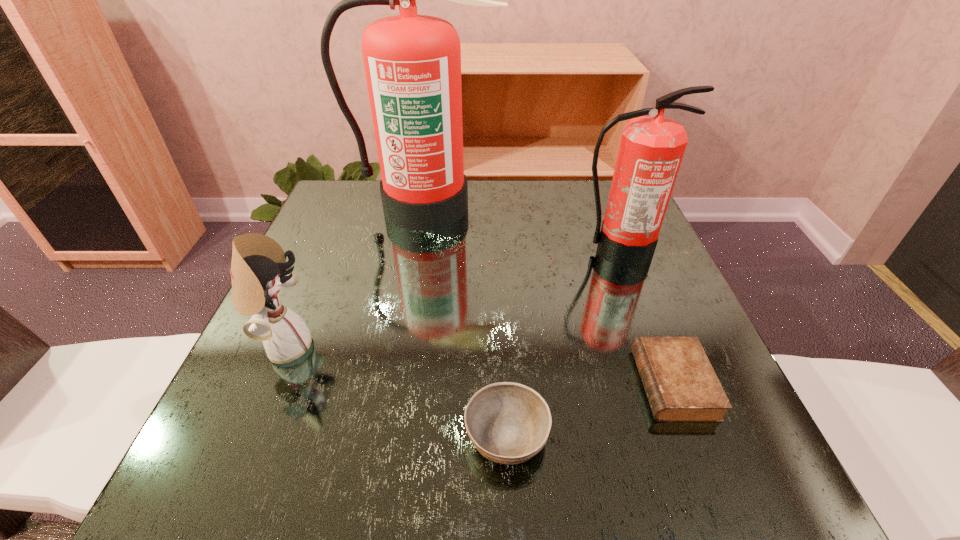
Where is `free space located on the back of the bowl`? Image resolution: width=960 pixels, height=540 pixels. free space located on the back of the bowl is located at coordinates (503, 370).

In order to click on vacant space situated on the spine side of the shortest object in this screenshot , I will do `click(556, 384)`.

The width and height of the screenshot is (960, 540). I want to click on vacant region located on the spine side of the shortest object, so point(406,384).

At what (x,y) coordinates should I click in order to perform the action: click on free space located on the spine side of the shortest object. Please return your answer as a coordinate pair (x, y). Looking at the image, I should click on (436, 384).

The height and width of the screenshot is (540, 960). In order to click on object that is at the far edge in this screenshot , I will do `click(412, 62)`.

Locate an element on the screen. Image resolution: width=960 pixels, height=540 pixels. object located in the near edge section of the desktop is located at coordinates (508, 423).

This screenshot has height=540, width=960. I want to click on fire extinguisher present at the left edge, so click(x=412, y=62).

Image resolution: width=960 pixels, height=540 pixels. Identify the location of doll at the left edge. (258, 269).

This screenshot has width=960, height=540. In order to click on fire extinguisher present at the right edge in this screenshot , I will do `click(651, 150)`.

Locate an element on the screen. diary positioned at the right edge is located at coordinates (681, 385).